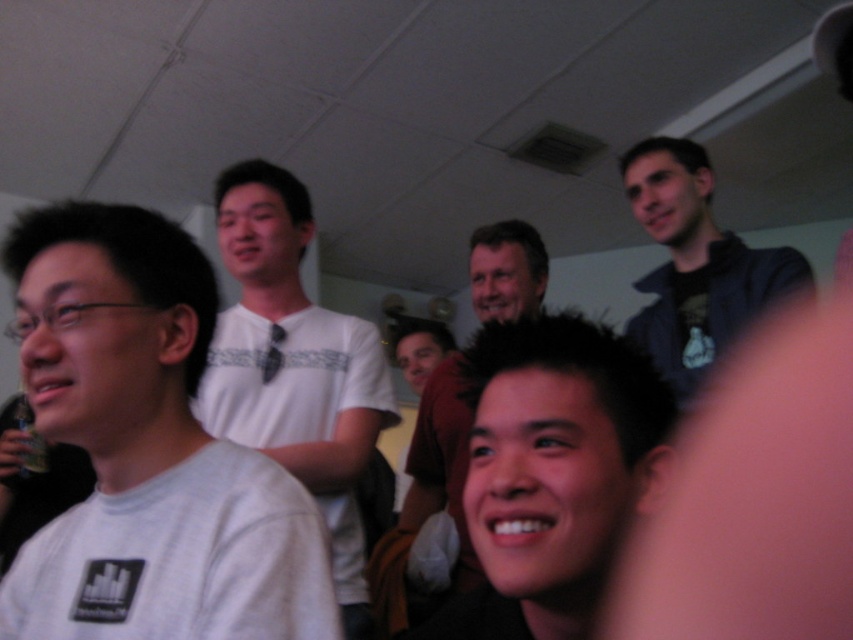
You are at a party and want to find the white matte shirt at left and the dark blue jacket at upper right. If you are facing the group, which direction should you look to see both people?

To see both the white matte shirt at left and the dark blue jacket at upper right, you should look to the left side and upper right direction since the white matte shirt at left is positioned to the left of the dark blue jacket at upper right.